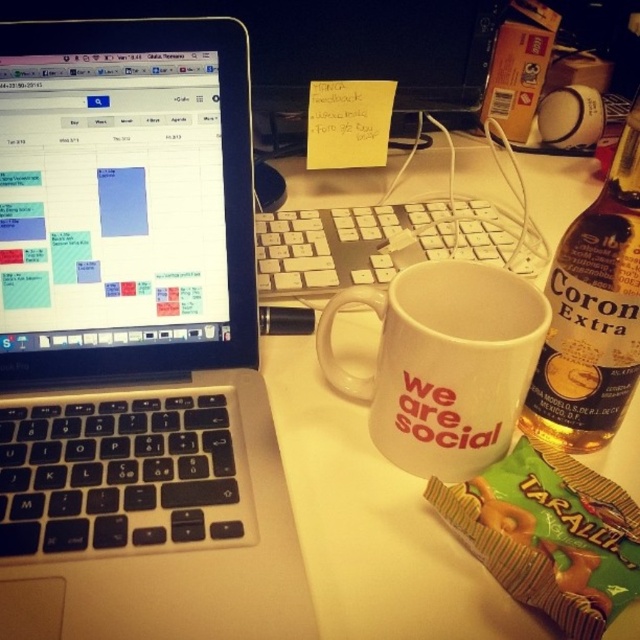
You are organizing the desk and want to move the translucent glass bottle at right to the left side. To do this, you first need to check if there is space between the white plastic keyboard at center and the edge of the desk. Can you determine if there is enough space for the bottle?

The translucent glass bottle at right is currently in front of the white plastic keyboard at center, so moving it to the left would require checking the space between the keyboard and the desk edge. However, without knowing the exact dimensions of the bottle and available space, it is impossible to confirm if there is enough space.

You are trying to reach for the bottle of Corona Extra beer behind the white mug with red text. If your hand is currently at the point marked at coordinates point (634, 198), can you grab the beer bottle without moving your hand? Please state your answer and the distance between the two objects.

The distance between the point (634, 198) and the bottle of Corona Extra beer is 15.67 inches. Since the hand is at the specified point, it cannot reach the beer bottle without moving because the distance is too large.

You are a delivery robot with a height of 24 inches. You need to deliver a package to the workspace shown in the image. The package must be placed at point (324, 484). Considering the distance between you and the point, will the package fit under the desk without hitting the desk surface?

The distance between the viewer and point (324, 484) is 17.59 inches. Since the robot is 24 inches tall, the package may hit the desk surface when placed there because the robot is taller than the available vertical space.